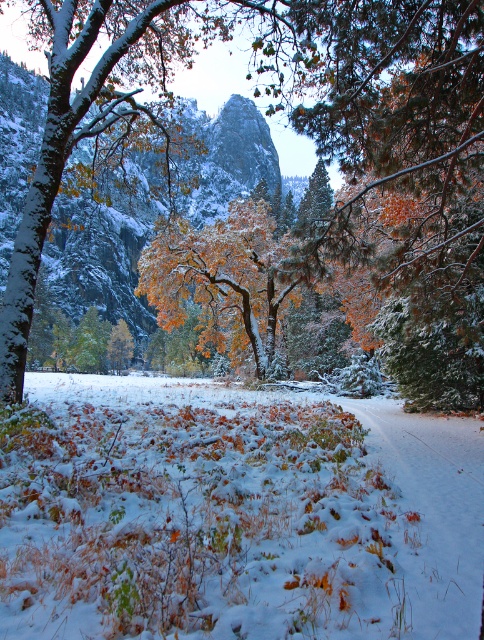
Which is more to the right, white fluffy snow at center or snow-covered tree at center?

Positioned to the right is white fluffy snow at center.

At what (x,y) coordinates should I click in order to perform the action: click on white fluffy snow at center. Please return your answer as a coordinate pair (x, y). The image size is (484, 640). Looking at the image, I should click on 236,515.

The image size is (484, 640). I want to click on white fluffy snow at center, so click(236, 515).

Is rocky gray mountain at center positioned behind golden leafy tree at center?

Yes, it is.

Identify the location of rocky gray mountain at center. (149, 204).

The image size is (484, 640). What do you see at coordinates (149, 204) in the screenshot?
I see `rocky gray mountain at center` at bounding box center [149, 204].

Where is `rocky gray mountain at center`? This screenshot has height=640, width=484. rocky gray mountain at center is located at coordinates (149, 204).

Does snow-covered tree at center have a lesser height compared to golden leafy tree at center?

In fact, snow-covered tree at center may be taller than golden leafy tree at center.

Does snow-covered tree at center come in front of golden leafy tree at center?

Yes.

What do you see at coordinates (275, 97) in the screenshot? Image resolution: width=484 pixels, height=640 pixels. I see `snow-covered tree at center` at bounding box center [275, 97].

Identify the location of snow-covered tree at center. (275, 97).